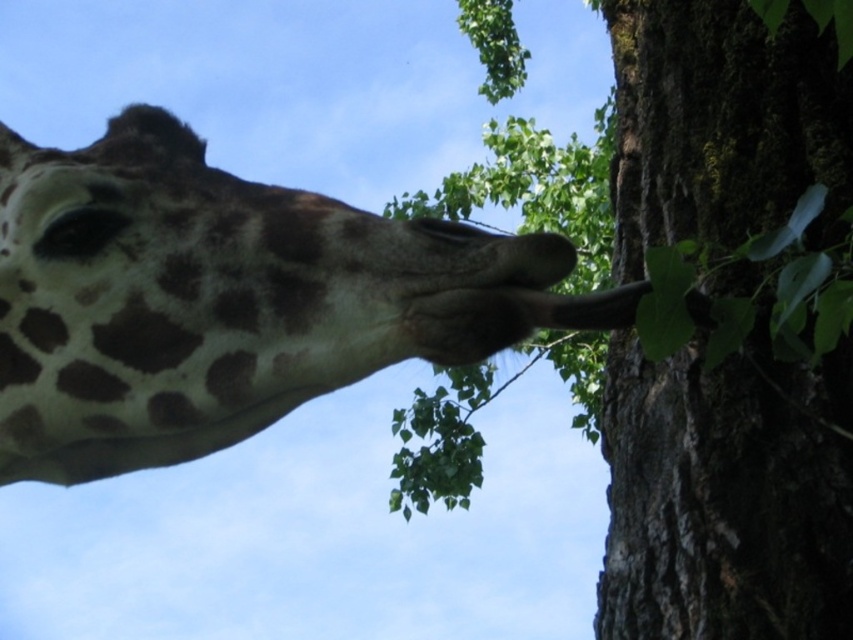
Question: Which point is farther to the camera?

Choices:
 (A) spotted fur at upper left
 (B) green mossy bark at upper right

Answer: (B)

Question: Can you confirm if spotted fur at upper left is wider than green mossy bark at upper right?

Choices:
 (A) yes
 (B) no

Answer: (A)

Question: Is spotted fur at upper left below green mossy bark at upper right?

Choices:
 (A) no
 (B) yes

Answer: (B)

Question: Does spotted fur at upper left have a lesser width compared to green mossy bark at upper right?

Choices:
 (A) yes
 (B) no

Answer: (B)

Question: Which object is farther from the camera taking this photo?

Choices:
 (A) green mossy bark at upper right
 (B) spotted fur at upper left

Answer: (A)